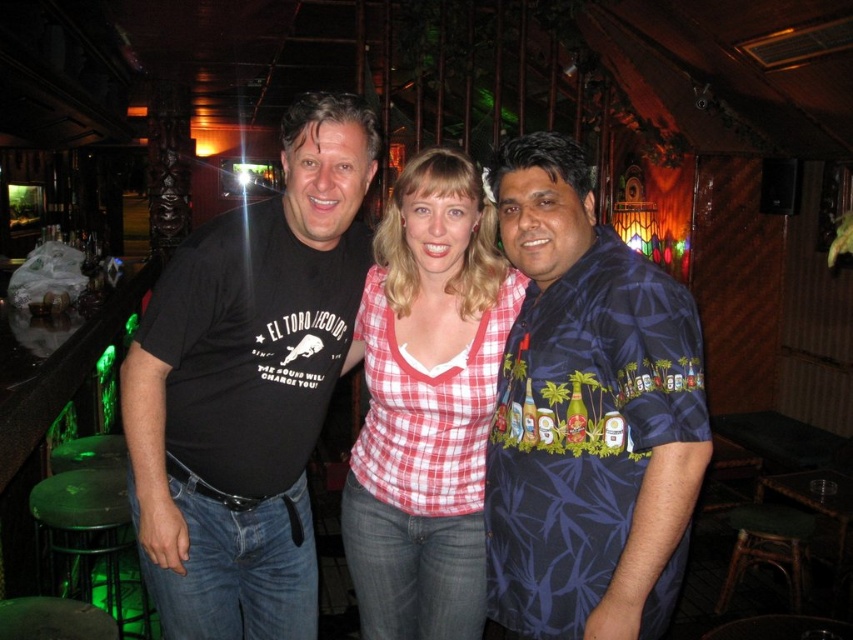
Question: Does red checkered shirt at center have a greater width compared to rattan stool at lower right?

Choices:
 (A) no
 (B) yes

Answer: (B)

Question: Does blue satin shirt at right appear over rattan stool at lower right?

Choices:
 (A) no
 (B) yes

Answer: (B)

Question: Does black t-shirt at center appear under blue satin shirt at right?

Choices:
 (A) yes
 (B) no

Answer: (A)

Question: Considering the real-world distances, which object is farthest from the blue satin shirt at right?

Choices:
 (A) red checkered shirt at center
 (B) black t-shirt at center
 (C) rattan stool at lower right

Answer: (C)

Question: Which of these objects is positioned farthest from the rattan stool at lower right?

Choices:
 (A) black t-shirt at center
 (B) red checkered shirt at center
 (C) blue satin shirt at right

Answer: (A)

Question: Among these objects, which one is nearest to the camera?

Choices:
 (A) blue satin shirt at right
 (B) red checkered shirt at center
 (C) black t-shirt at center

Answer: (A)